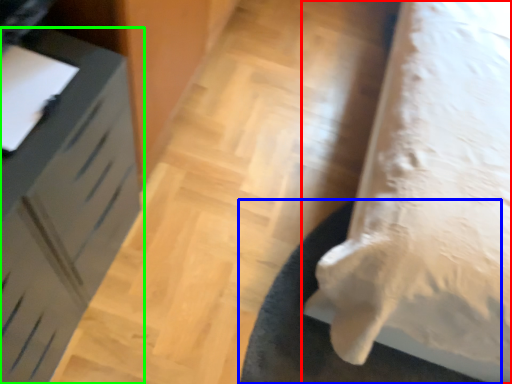
Question: Estimate the real-world distances between objects in this image. Which object is closer to furniture (highlighted by a red box), mat (highlighted by a blue box) or furniture (highlighted by a green box)?

Choices:
 (A) mat
 (B) furniture

Answer: (A)